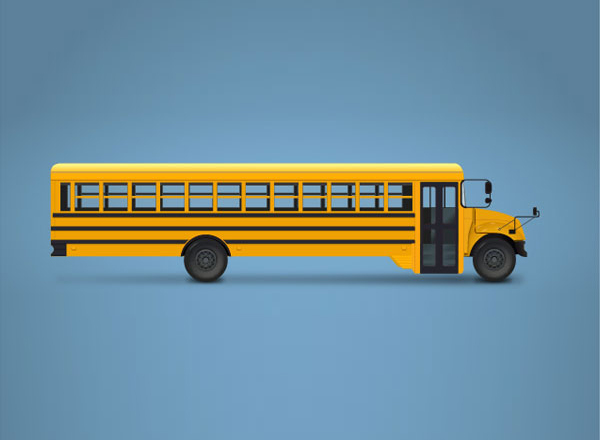
This screenshot has height=440, width=600. Identify the location of upper right quadrant of door. (451, 200).